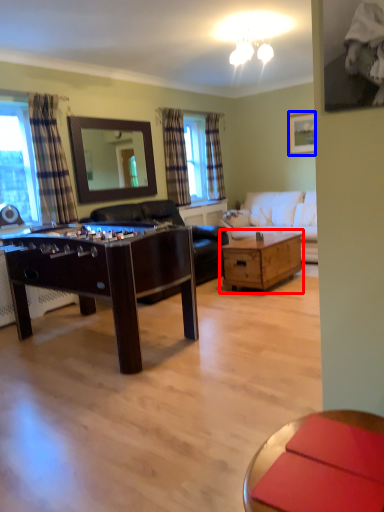
Question: Among these objects, which one is nearest to the camera, table (highlighted by a red box) or picture frame (highlighted by a blue box)?

Choices:
 (A) table
 (B) picture frame

Answer: (A)